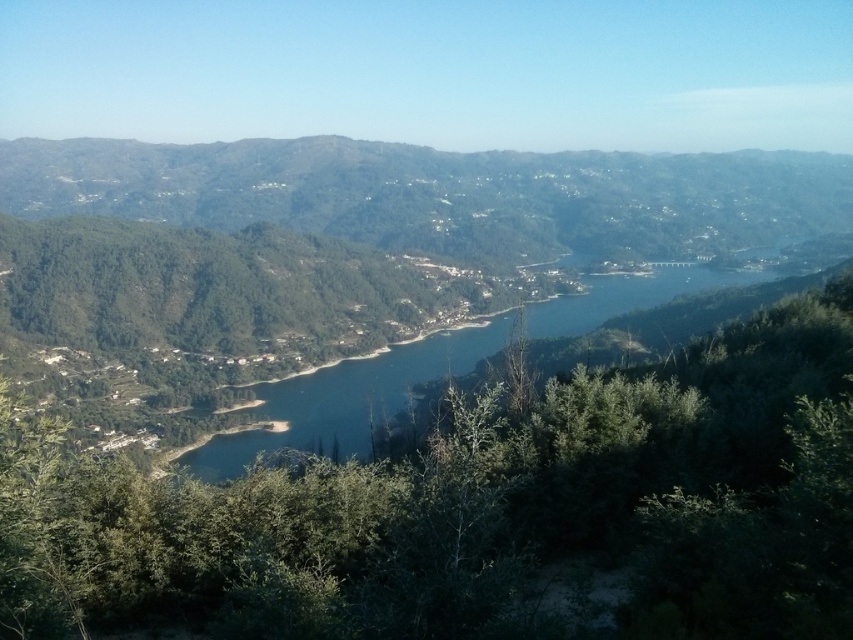
Question: From the image, what is the correct spatial relationship of green leafy mountain at left in relation to blue water at center?

Choices:
 (A) right
 (B) left

Answer: (B)

Question: Which of the following is the closest to the observer?

Choices:
 (A) blue water at center
 (B) green leafy tree at center
 (C) green leafy mountain at left

Answer: (B)

Question: Among these points, which one is nearest to the camera?

Choices:
 (A) (357, 396)
 (B) (84, 157)

Answer: (A)

Question: Is green leafy tree at center below green leafy mountain at left?

Choices:
 (A) yes
 (B) no

Answer: (A)

Question: Which point appears closest to the camera in this image?

Choices:
 (A) (706, 282)
 (B) (457, 500)
 (C) (514, 227)

Answer: (B)

Question: Can you confirm if green leafy tree at center is positioned to the right of green leafy mountain at left?

Choices:
 (A) no
 (B) yes

Answer: (A)